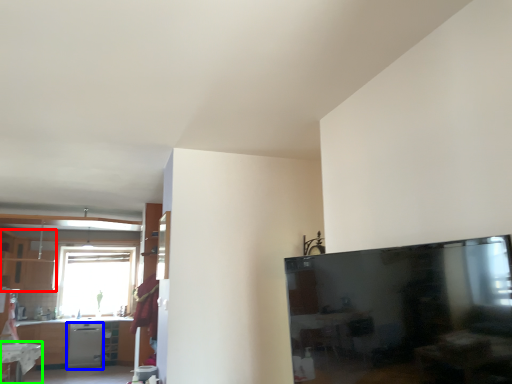
Question: Which is nearer to the cabinetry (highlighted by a red box)? dish washer (highlighted by a blue box) or table (highlighted by a green box).

Choices:
 (A) dish washer
 (B) table

Answer: (A)